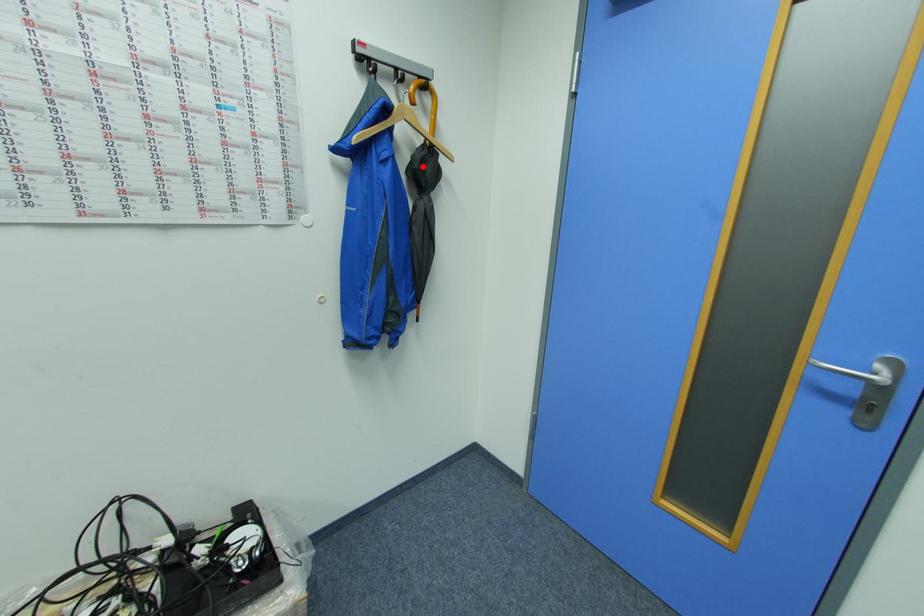
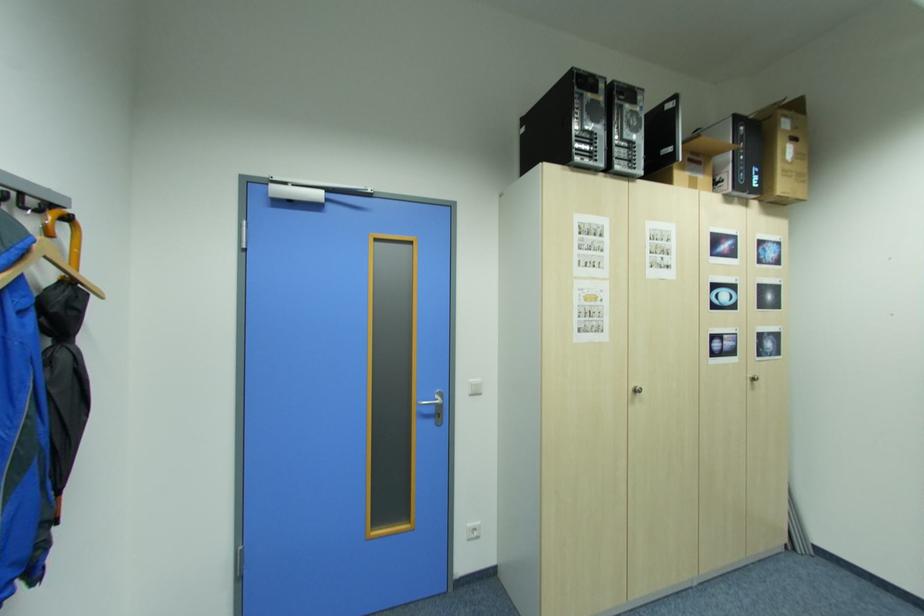
Locate, in the second image, the point that corresponds to the highlighted location in the first image.

(64, 310)